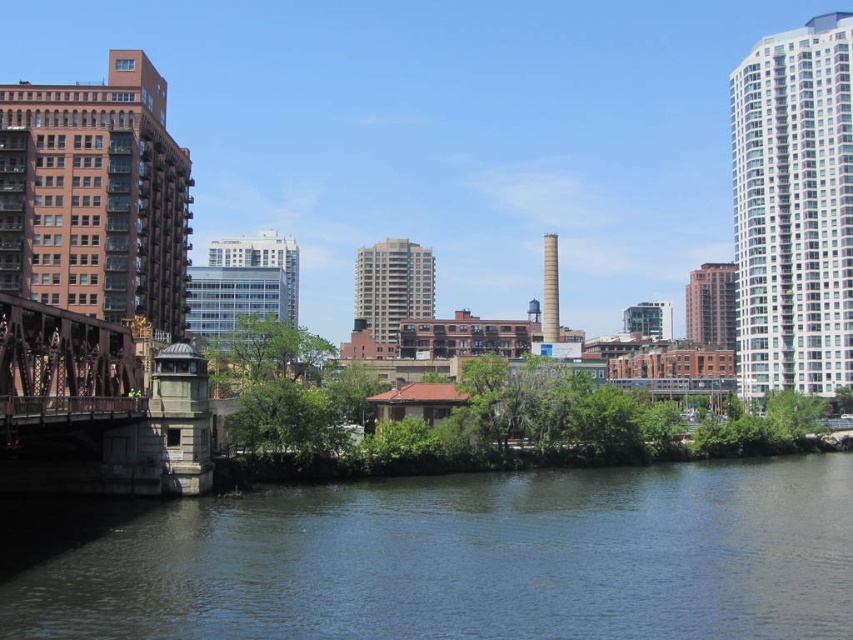
Question: Is dark blue water at lower center below rusty metal bridge at left?

Choices:
 (A) yes
 (B) no

Answer: (A)

Question: Is dark blue water at lower center smaller than rusty metal bridge at left?

Choices:
 (A) yes
 (B) no

Answer: (B)

Question: Can you confirm if dark blue water at lower center is positioned below rusty metal bridge at left?

Choices:
 (A) no
 (B) yes

Answer: (B)